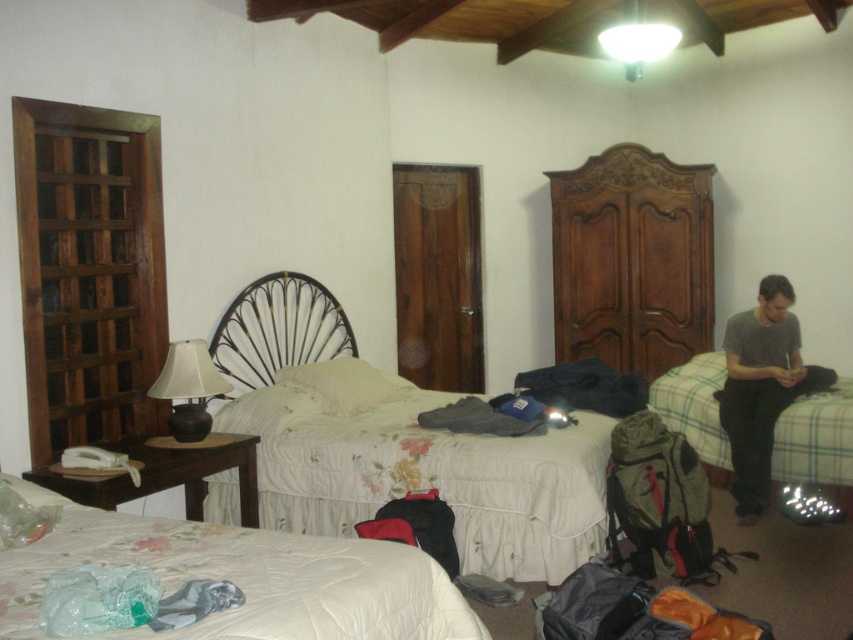
Can you confirm if gray cotton shirt at right is bigger than iron/textured headboard at center?

No, gray cotton shirt at right is not bigger than iron/textured headboard at center.

Is point (773, 388) positioned before point (320, 324)?

Yes, point (773, 388) is in front of point (320, 324).

I want to click on gray cotton shirt at right, so click(x=762, y=387).

Which of these two, wooden lattice door at left or matte black lamp at left, stands shorter?

matte black lamp at left

Does wooden lattice door at left come behind matte black lamp at left?

No.

Between point (19, 227) and point (189, 442), which one is positioned in front?

Point (19, 227) is more forward.

Where is `wooden lattice door at left`? This screenshot has height=640, width=853. wooden lattice door at left is located at coordinates (90, 273).

Between point (73, 330) and point (305, 333), which one is positioned behind?

Point (305, 333)

Is wooden lattice door at left positioned before iron/textured headboard at center?

Yes, wooden lattice door at left is closer to the viewer.

Which is behind, point (86, 282) or point (277, 305)?

The point (277, 305) is behind.

This screenshot has width=853, height=640. I want to click on wooden lattice door at left, so click(x=90, y=273).